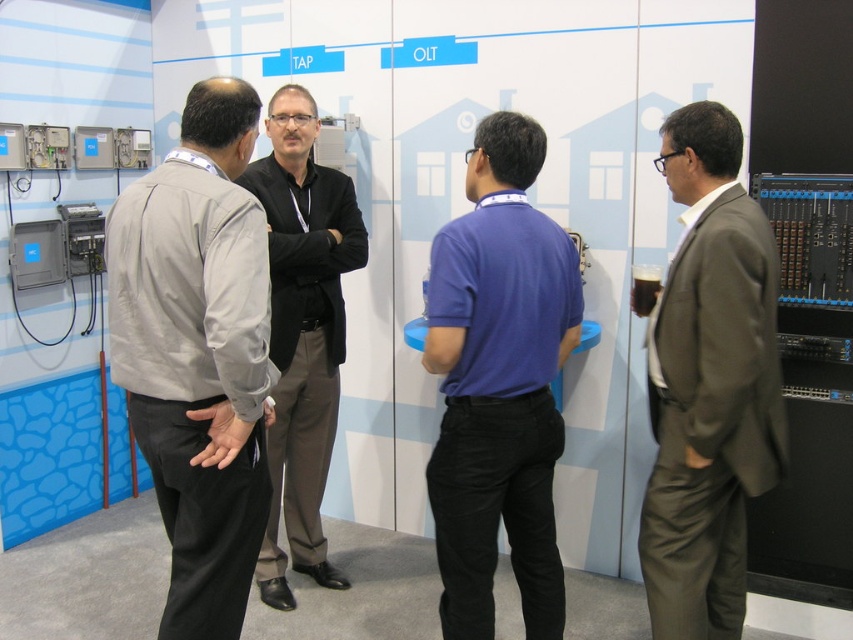
Does matte brown suit at right come in front of black smooth shirt at center?

Yes.

Which is in front, point (692, 204) or point (260, 164)?

Positioned in front is point (692, 204).

The width and height of the screenshot is (853, 640). Describe the element at coordinates (709, 385) in the screenshot. I see `matte brown suit at right` at that location.

Locate an element on the screen. matte brown suit at right is located at coordinates (709, 385).

Which is below, light gray fabric jacket at left or matte brown suit at right?

matte brown suit at right is lower down.

Which is more to the left, light gray fabric jacket at left or matte brown suit at right?

From the viewer's perspective, light gray fabric jacket at left appears more on the left side.

What are the coordinates of `light gray fabric jacket at left` in the screenshot? It's located at (198, 353).

This screenshot has width=853, height=640. Identify the location of light gray fabric jacket at left. (198, 353).

Is purple cotton polo shirt at center to the right of matte brown suit at right from the viewer's perspective?

No, purple cotton polo shirt at center is not to the right of matte brown suit at right.

Between point (521, 276) and point (730, 291), which one is positioned in front?

Point (730, 291) is in front.

Where is `purple cotton polo shirt at center`? This screenshot has height=640, width=853. purple cotton polo shirt at center is located at coordinates (498, 384).